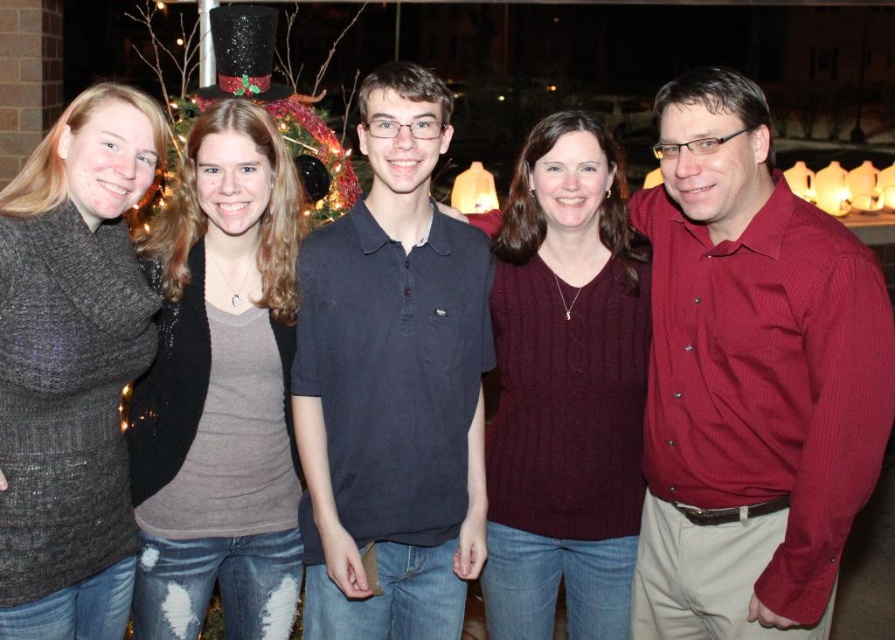
You are a photographer standing 1.5 meters away from the matte gray shirt at center. You want to take a photo of the glittering plastic christmas light at upper center without moving your position. Can you capture the light in the frame if your camera has a 1.5 meter range?

The distance between the matte gray shirt at center and the glittering plastic christmas light at upper center is 2.07 meters. Since you are 1.5 meters away from the shirt, the total distance to the light would be 1.5 meters plus 2.07 meters, totaling 3.57 meters. Your camera only has a 1.5 meter range, so you cannot capture the light in the frame without moving closer.

You are a photographer taking a picture of the festive group. You notice a matte gray shirt at center located at point (220, 388). If you want to focus on this person, where should you aim your camera?

The matte gray shirt at center is located at point (220, 388), so you should aim your camera at that coordinate to focus on the person.